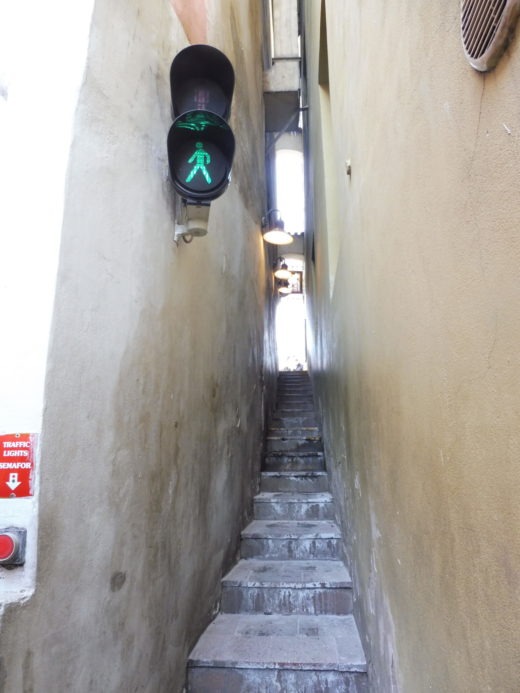
Find the location of `lights`. lights is located at coordinates (280, 235), (283, 274), (285, 292), (195, 161).